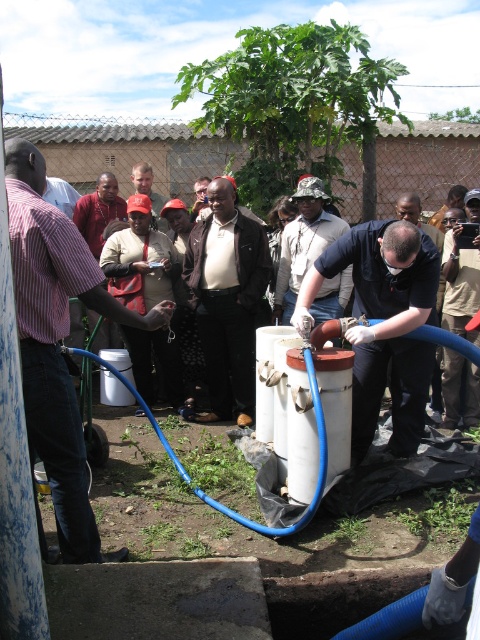
Does matte pink shirt at left lie behind camouflage fabric shirt at center?

No, it is not.

Does point (48, 285) lie in front of point (328, 232)?

That is True.

The width and height of the screenshot is (480, 640). I want to click on matte pink shirt at left, so click(x=57, y=340).

Is matte pink shirt at left positioned at the back of black matte shirt at center?

That is False.

Which of these two, matte pink shirt at left or black matte shirt at center, stands taller?

matte pink shirt at left

Which is behind, point (45, 452) or point (435, 384)?

Point (435, 384)

Find the location of `matte pink shirt at left`. matte pink shirt at left is located at coordinates (57, 340).

What do you see at coordinates (303, 243) in the screenshot? I see `camouflage fabric shirt at center` at bounding box center [303, 243].

Is camouflage fabric shirt at center closer to camera compared to red cap at center?

Yes, it is.

Image resolution: width=480 pixels, height=640 pixels. In order to click on camouflage fabric shirt at center in this screenshot , I will do `click(303, 243)`.

You are a GUI agent. You are given a task and a screenshot of the screen. Output one action in this format:
    pyautogui.click(x=<x>, y=<y>)
    Task: Click on the camouflage fabric shirt at center
    Image resolution: width=480 pixels, height=640 pixels.
    Given the screenshot: What is the action you would take?
    pyautogui.click(x=303, y=243)